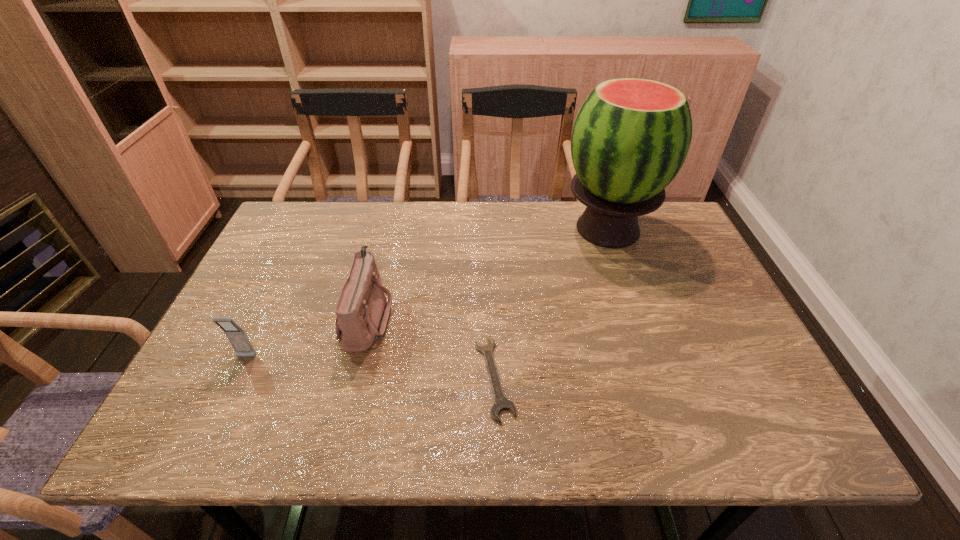
Image resolution: width=960 pixels, height=540 pixels. In order to click on the rightmost object in this screenshot , I will do `click(631, 136)`.

This screenshot has height=540, width=960. I want to click on the farthest object, so click(x=631, y=136).

I want to click on shoulder bag, so click(362, 312).

This screenshot has height=540, width=960. What are the coordinates of `cellular telephone` in the screenshot? It's located at (237, 337).

Image resolution: width=960 pixels, height=540 pixels. Find the location of `the second object from right to left`. the second object from right to left is located at coordinates (501, 403).

The width and height of the screenshot is (960, 540). I want to click on wrench, so click(501, 403).

At what (x,y) coordinates should I click in order to perform the action: click on vacant space located on the left of the farthest object. Please return your answer as a coordinate pair (x, y). This screenshot has height=540, width=960. Looking at the image, I should click on click(511, 230).

The height and width of the screenshot is (540, 960). Find the location of `free space located on the front pocket of the shoulder bag`. free space located on the front pocket of the shoulder bag is located at coordinates coord(471,318).

The width and height of the screenshot is (960, 540). I want to click on vacant position located on the front-facing side of the cellular telephone, so click(x=204, y=446).

This screenshot has height=540, width=960. I want to click on free space located 0.290m on the back of the shortest object, so click(491, 258).